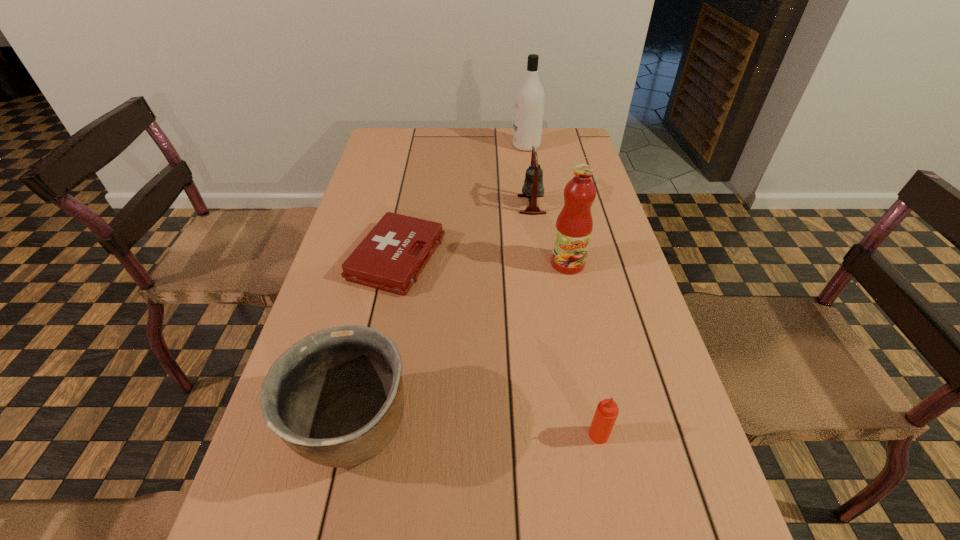
This screenshot has width=960, height=540. Find the location of `shampoo`. shampoo is located at coordinates (530, 98).

Identify the location of fruit juice. This screenshot has height=540, width=960. (574, 225).

Where is `the second farthest object`? the second farthest object is located at coordinates (533, 187).

I want to click on pottery, so click(336, 397).

Locate an element on the screen. the fifth tallest object is located at coordinates (606, 413).

Identify the location of the first-aid kit. Image resolution: width=960 pixels, height=540 pixels. (390, 258).

Identify the location of vacant space situated on the front-facing side of the shampoo. The image size is (960, 540). point(464,146).

I want to click on vacant space located 0.370m on the front-facing side of the shampoo, so click(x=407, y=146).

Where is `free location located 0.200m on the front-facing side of the shampoo`? The image size is (960, 540). free location located 0.200m on the front-facing side of the shampoo is located at coordinates (455, 146).

Identify the location of vacant space situated on the front label of the fruit juice. (583, 337).